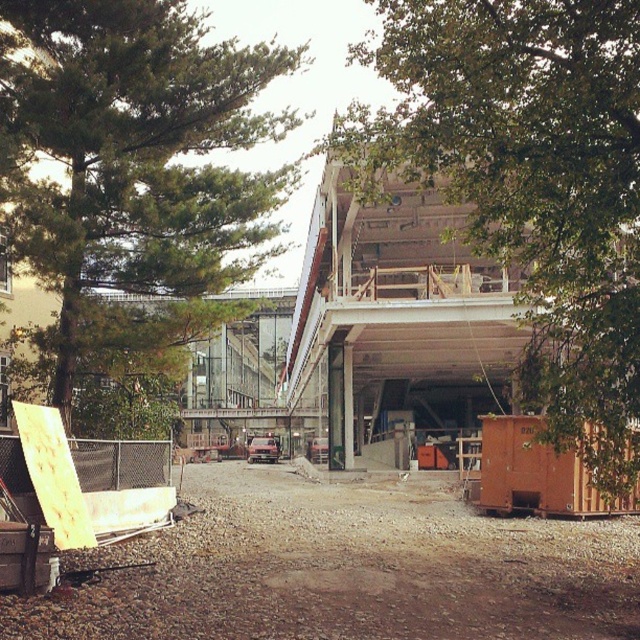
Question: Does green leafy tree at upper right appear on the right side of green leafy tree at upper left?

Choices:
 (A) yes
 (B) no

Answer: (A)

Question: Which point appears farthest from the camera in this image?

Choices:
 (A) (122, 252)
 (B) (634, 136)

Answer: (A)

Question: Can you confirm if green leafy tree at upper right is smaller than green leafy tree at upper left?

Choices:
 (A) yes
 (B) no

Answer: (A)

Question: Considering the relative positions of green leafy tree at upper right and green leafy tree at upper left in the image provided, where is green leafy tree at upper right located with respect to green leafy tree at upper left?

Choices:
 (A) below
 (B) above

Answer: (A)

Question: Which of the following is the farthest from the observer?

Choices:
 (A) green leafy tree at upper right
 (B) green leafy tree at upper left

Answer: (B)